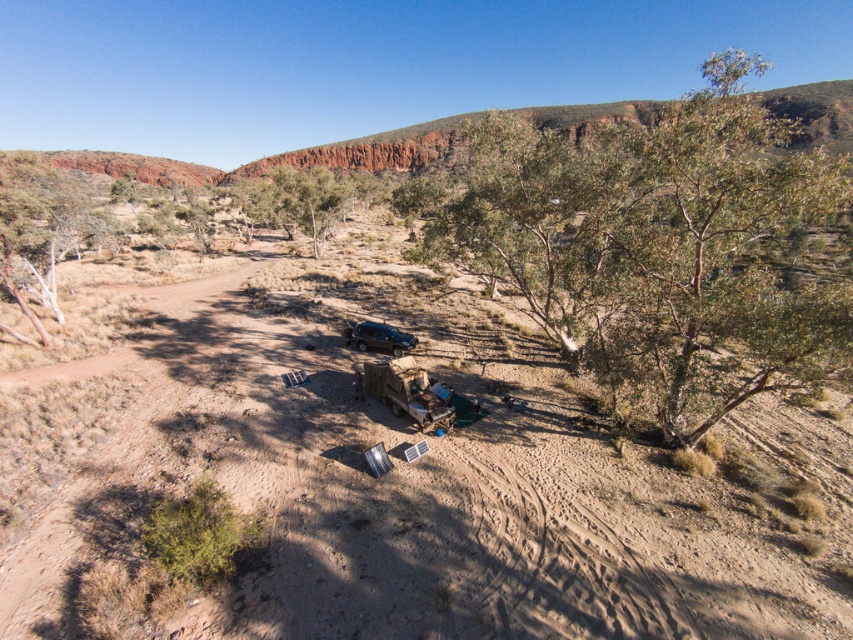
Question: Which point is closer to the camera?

Choices:
 (A) matte black jeep at center
 (B) green leafy tree at center

Answer: (B)

Question: Does brown sandy dirt field at center have a greater width compared to green leafy tree at center?

Choices:
 (A) no
 (B) yes

Answer: (A)

Question: Is brown sandy dirt field at center positioned in front of green leafy tree at center?

Choices:
 (A) no
 (B) yes

Answer: (B)

Question: From the image, what is the correct spatial relationship of brown sandy dirt field at center in relation to green leafy tree at center?

Choices:
 (A) left
 (B) right

Answer: (A)

Question: Which is nearer to the green leafy tree at center?

Choices:
 (A) matte black jeep at center
 (B) brown sandy dirt field at center

Answer: (B)

Question: Which of these objects is positioned farthest from the matte black jeep at center?

Choices:
 (A) green leafy tree at center
 (B) brown sandy dirt field at center

Answer: (A)